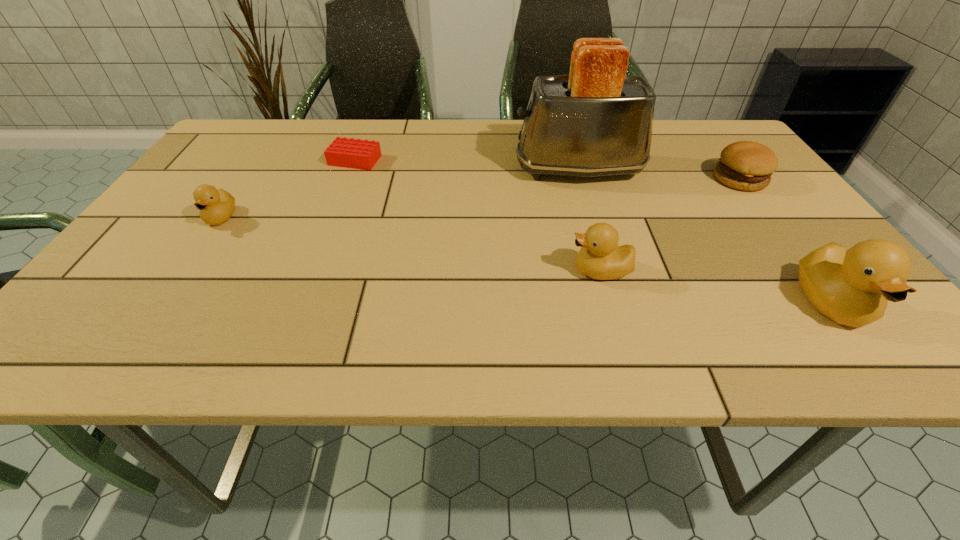
Point out which object is positioned as the nearest to the shortest duckling. Please provide its 2D coordinates. Your answer should be formatted as a tuple, i.e. [(x, y)], where the tuple contains the x and y coordinates of a point satisfying the conditions above.

[(353, 153)]

The image size is (960, 540). I want to click on duckling object that ranks as the second closest to the hamburger, so click(x=600, y=258).

You are a GUI agent. You are given a task and a screenshot of the screen. Output one action in this format:
    pyautogui.click(x=<x>, y=<y>)
    Task: Click on the duckling that is the second closest to the hamburger
    
    Given the screenshot: What is the action you would take?
    pyautogui.click(x=600, y=258)

What are the coordinates of `free point that satisfies the following two spatial constraints: 1. on the front side of the hamburger; 2. on the face of the second duckling from left to right` in the screenshot? It's located at (809, 271).

You are a GUI agent. You are given a task and a screenshot of the screen. Output one action in this format:
    pyautogui.click(x=<x>, y=<y>)
    Task: Click on the free location that satisfies the following two spatial constraints: 1. on the front side of the hamburger; 2. on the right side of the shortest object
    Image resolution: width=960 pixels, height=540 pixels.
    Given the screenshot: What is the action you would take?
    pyautogui.click(x=348, y=179)

The height and width of the screenshot is (540, 960). What are the coordinates of `free space in the image that satisfies the following two spatial constraints: 1. on the side of the toaster with the control lever; 2. on the face of the farthest duckling` in the screenshot? It's located at (593, 217).

The image size is (960, 540). Find the location of `free space that satisfies the following two spatial constraints: 1. on the side of the hamburger with the control lever; 2. on the left side of the tallest object`. free space that satisfies the following two spatial constraints: 1. on the side of the hamburger with the control lever; 2. on the left side of the tallest object is located at coordinates (582, 179).